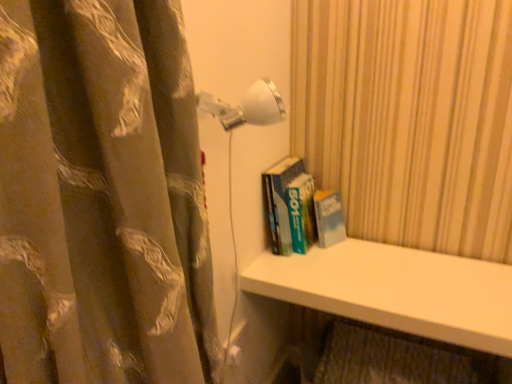
The width and height of the screenshot is (512, 384). I want to click on vacant region to the right of hardcover book at center, so click(367, 258).